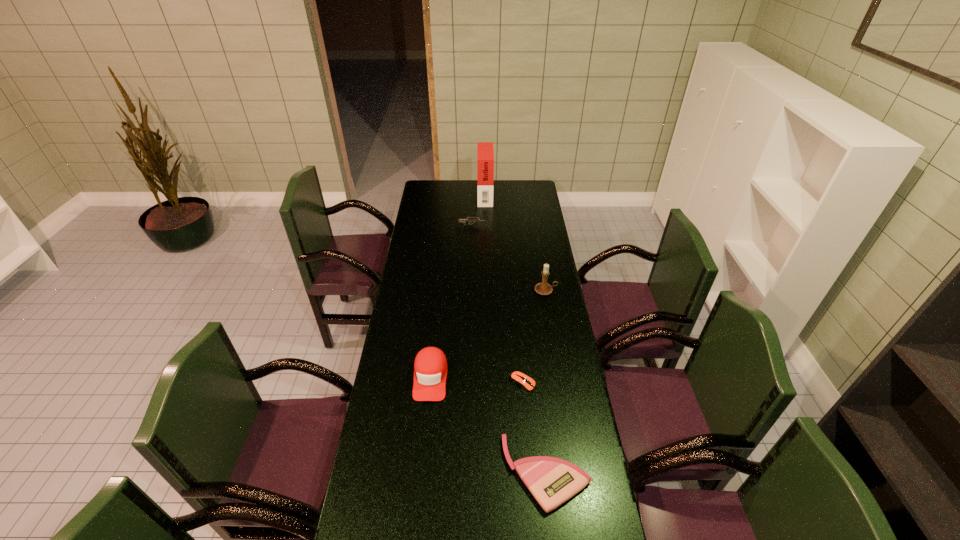
Find the location of a particular element. Image resolution: width=960 pixels, height=540 pixels. free space that satisfies the following two spatial constraints: 1. aimed along the barrel of the gun; 2. on the back side of the computer mouse is located at coordinates (468, 383).

Identify the location of vacant area in the image that satisfies the following two spatial constraints: 1. aimed along the barrel of the third shortest object; 2. on the front-facing side of the fourth shortest object. The image size is (960, 540). (468, 377).

This screenshot has height=540, width=960. I want to click on free space that satisfies the following two spatial constraints: 1. on the side of the candle holder with the handle; 2. on the front-facing side of the third tallest object, so click(x=560, y=377).